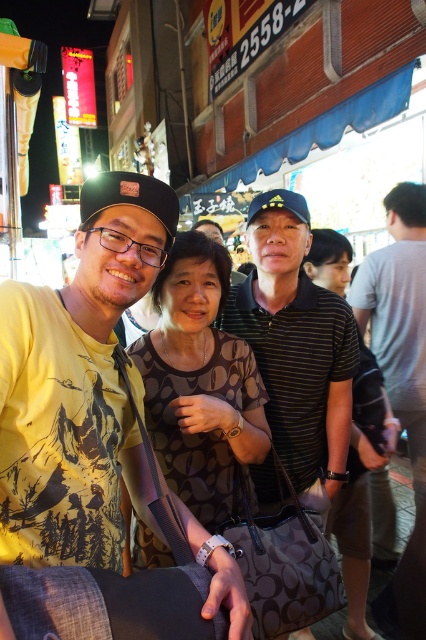
Question: In this image, where is dark brown textured blouse at center located relative to black striped shirt at center?

Choices:
 (A) below
 (B) above

Answer: (B)

Question: Can you confirm if striped cotton polo shirt at center is wider than black striped shirt at center?

Choices:
 (A) yes
 (B) no

Answer: (A)

Question: Which object is the closest to the striped cotton polo shirt at center?

Choices:
 (A) black striped shirt at center
 (B) dark brown textured blouse at center

Answer: (B)

Question: Among these objects, which one is farthest from the camera?

Choices:
 (A) striped cotton polo shirt at center
 (B) black striped shirt at center

Answer: (B)

Question: Which point is closer to the camera?

Choices:
 (A) black striped shirt at center
 (B) dark brown textured blouse at center

Answer: (B)

Question: Can you confirm if striped cotton polo shirt at center is positioned below black striped shirt at center?

Choices:
 (A) yes
 (B) no

Answer: (B)